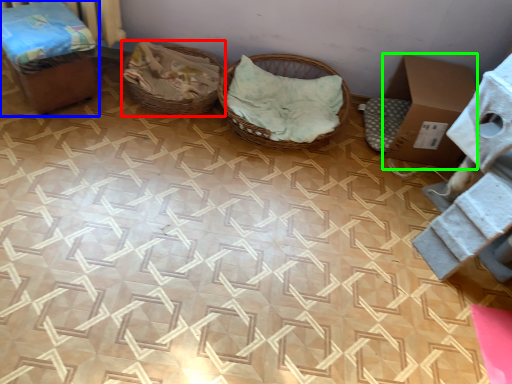
Question: Which object is the farthest from basket (highlighted by a red box)? Choose among these: furniture (highlighted by a blue box) or cardboard box (highlighted by a green box).

Choices:
 (A) furniture
 (B) cardboard box

Answer: (B)